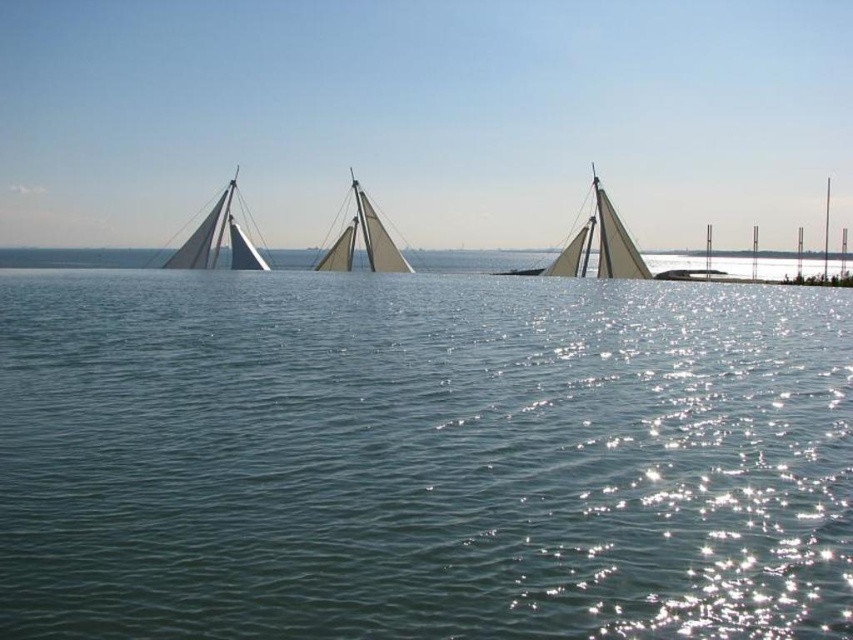
Which of these two, clear blue water at center or white canvas sailboat at center, stands taller?

With more height is white canvas sailboat at center.

Who is more distant from viewer, (503, 291) or (358, 212)?

Positioned behind is point (358, 212).

Identify the location of clear blue water at center. The width and height of the screenshot is (853, 640). (421, 458).

Is point (57, 394) positioned in front of point (633, 248)?

That is True.

In the scene shown: Can you confirm if clear blue water at center is positioned above white matte sailboat at center?

No.

This screenshot has height=640, width=853. Identify the location of clear blue water at center. (421, 458).

Is white matte sailboat at center smaller than white matte sailboat at left?

No.

Image resolution: width=853 pixels, height=640 pixels. I want to click on white matte sailboat at center, so tap(601, 244).